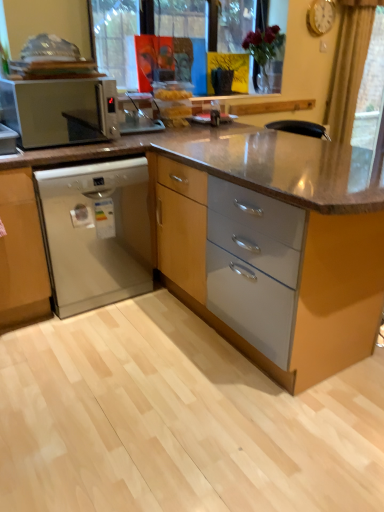
Question: From the image's perspective, is white plastic microwave at left located above or below matte wood cabinet at center?

Choices:
 (A) below
 (B) above

Answer: (B)

Question: Is white plastic microwave at left bigger or smaller than matte wood cabinet at center?

Choices:
 (A) big
 (B) small

Answer: (B)

Question: Estimate the real-world distances between objects in this image. Which object is farther from the beige fabric curtain at upper right?

Choices:
 (A) satin silver dishwasher at lower left
 (B) white plastic microwave at left
 (C) matte wood cabinet at center

Answer: (B)

Question: Based on their relative distances, which object is nearer to the satin silver dishwasher at lower left?

Choices:
 (A) beige fabric curtain at upper right
 (B) matte wood cabinet at center
 (C) white plastic microwave at left

Answer: (B)